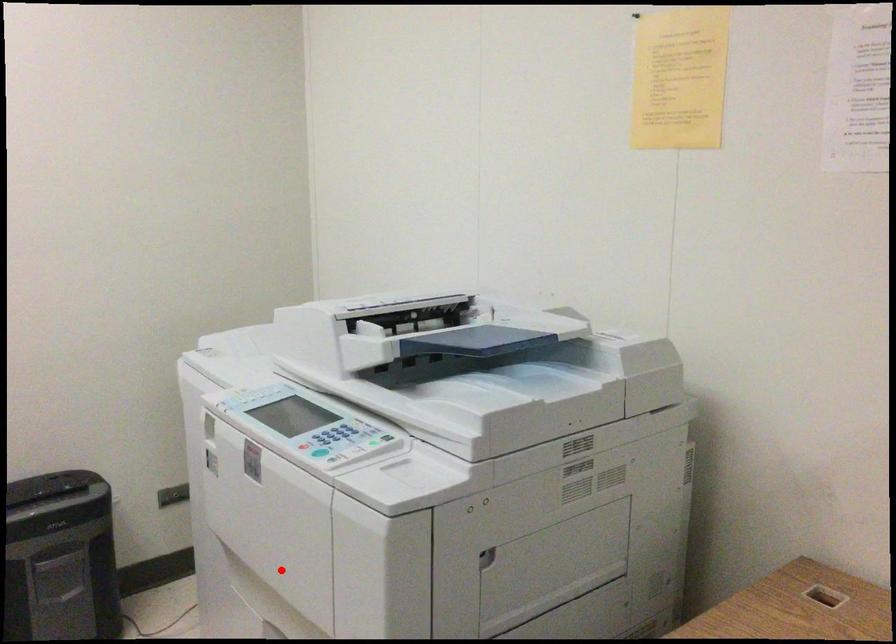
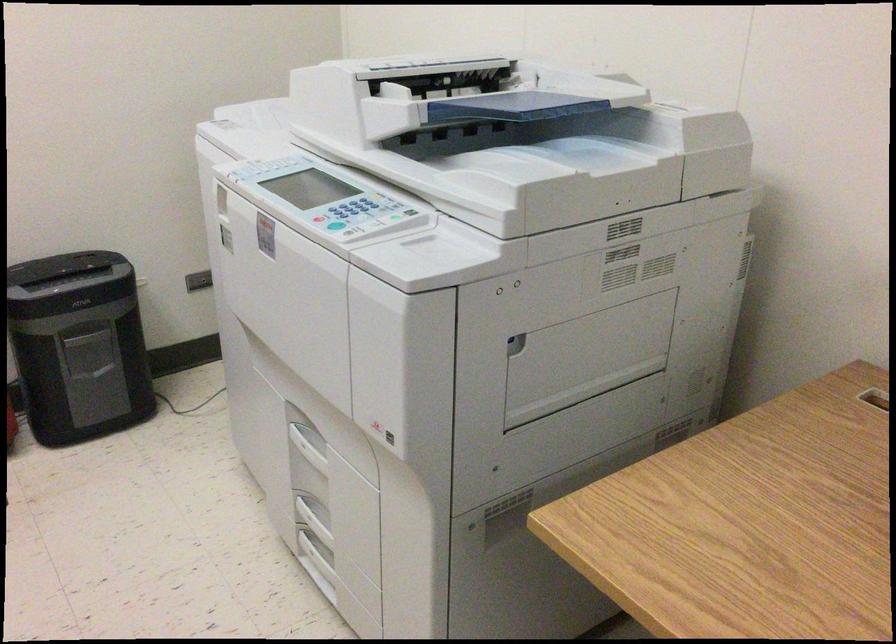
In the second image, find the point that corresponds to the highlighted location in the first image.

(296, 350)